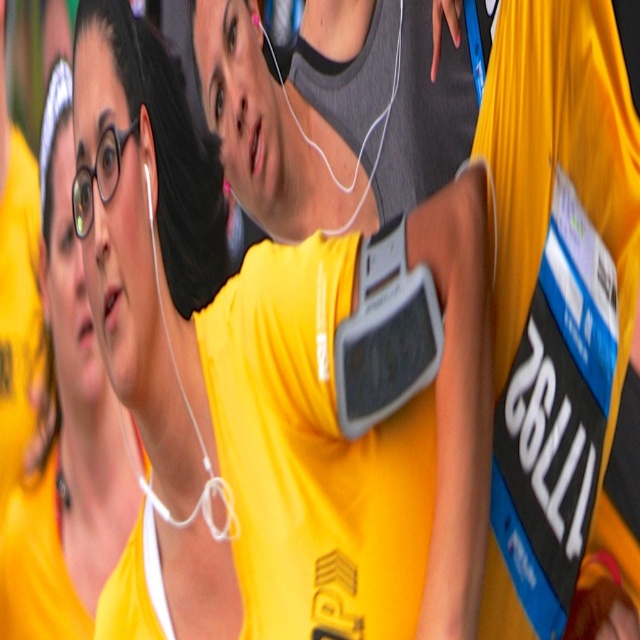
You are a photographer at the running event and want to ensure both runners with the matte yellow shirt at center and the matte yellow shirt at left are clearly visible in your photo. Which runner should you focus on to capture the most detail?

The matte yellow shirt at center has a larger size compared to the matte yellow shirt at left, so focusing on the matte yellow shirt at center will allow you to capture more detail since it is larger and occupies more of the frame.

You are a photographer at the running event. You want to take a photo that includes both the matte yellow shirt at center and the matte yellow shirt at left. Which shirt should you focus on to ensure the other is still in frame?

The matte yellow shirt at center has a lesser height compared to matte yellow shirt at left. Therefore, focusing on the matte yellow shirt at left would allow the shorter matte yellow shirt at center to remain in the frame as it is positioned lower.